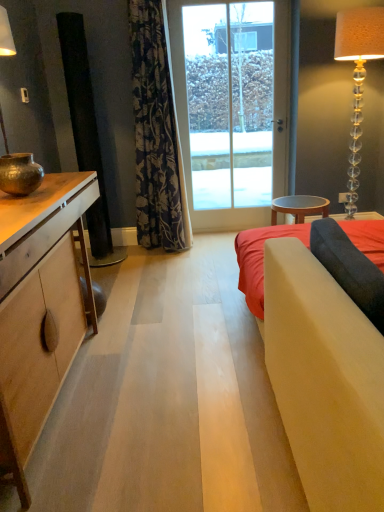
Find the location of a particular element. free spot to the right of matte wood cabinet at left is located at coordinates (172, 374).